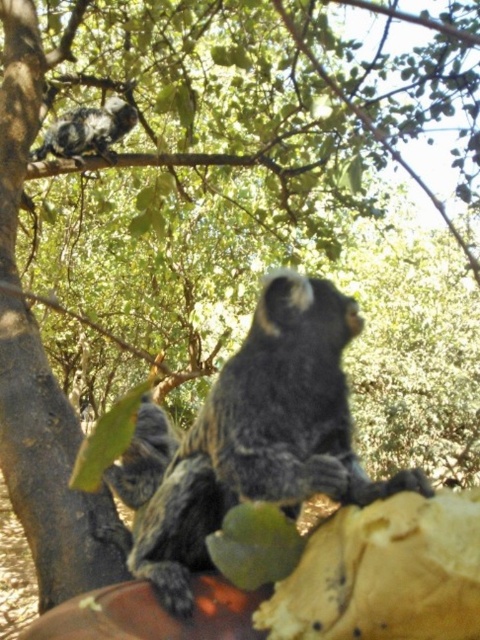
Question: Among these points, which one is farthest from the camera?

Choices:
 (A) (148, 484)
 (B) (241, 387)

Answer: (A)

Question: Which object appears closest to the camera in this image?

Choices:
 (A) white fur monkey at upper left
 (B) green matte leaf at lower center

Answer: (B)

Question: Is green matte leaf at lower center to the right of dark gray fur monkey at center from the viewer's perspective?

Choices:
 (A) yes
 (B) no

Answer: (A)

Question: Among these points, which one is nearest to the camera?

Choices:
 (A) (171, 433)
 (B) (276, 547)
 (C) (41, 154)

Answer: (B)

Question: Can you confirm if dark gray fur monkey at center is thinner than white fur monkey at upper left?

Choices:
 (A) yes
 (B) no

Answer: (A)

Question: Can you confirm if soft gray fur monkey at center is positioned below dark gray fur monkey at center?

Choices:
 (A) no
 (B) yes

Answer: (A)